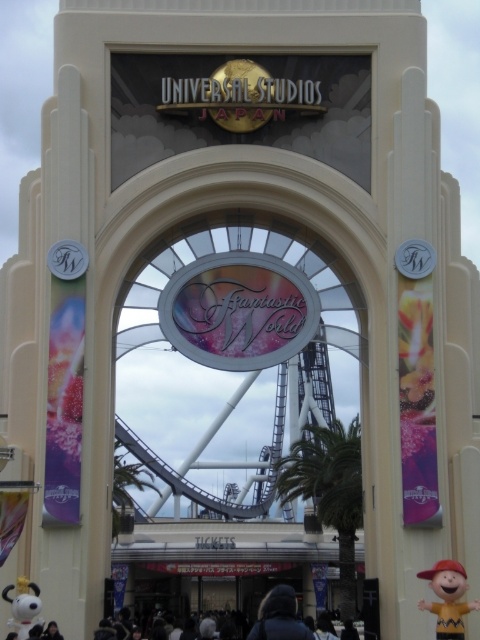
Question: Is green leafy palm tree at center further to the viewer compared to white matte snoopy at lower left?

Choices:
 (A) yes
 (B) no

Answer: (A)

Question: Can you confirm if yellow matte doll at lower right is wider than white matte snoopy at lower left?

Choices:
 (A) no
 (B) yes

Answer: (B)

Question: Estimate the real-world distances between objects in this image. Which object is closer to the yellow matte doll at lower right?

Choices:
 (A) green leafy palm tree at center
 (B) white matte snoopy at lower left
 (C) dark blue jacket at center

Answer: (C)

Question: Which object is positioned farthest from the yellow matte doll at lower right?

Choices:
 (A) white matte snoopy at lower left
 (B) dark blue jacket at center
 (C) green leafy palm tree at center

Answer: (C)

Question: Observing the image, what is the correct spatial positioning of dark blue jacket at center in reference to white matte snoopy at lower left?

Choices:
 (A) below
 (B) above

Answer: (A)

Question: Which of the following is the closest to the observer?

Choices:
 (A) (477, 602)
 (B) (33, 592)
 (C) (262, 618)

Answer: (A)